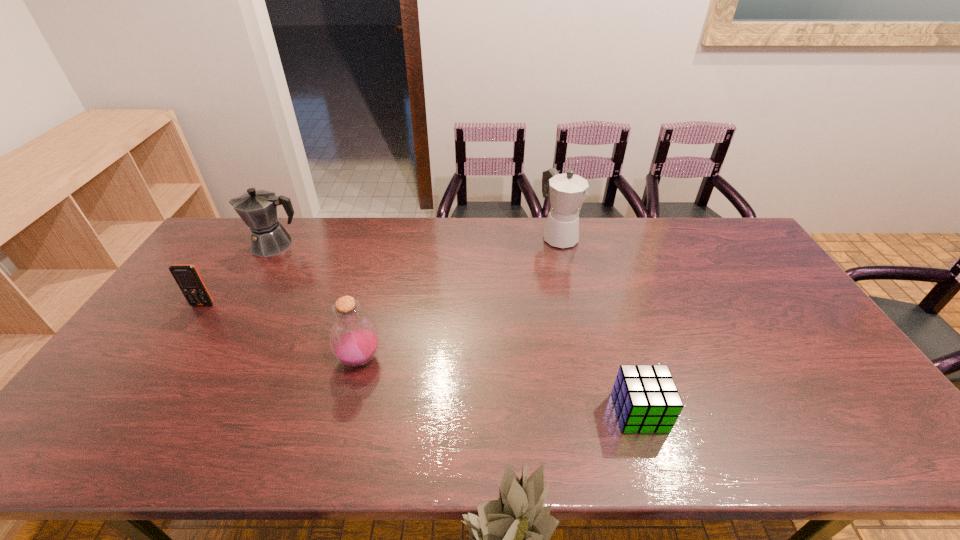
What are the coordinates of `the taller coffeepot` in the screenshot? It's located at (568, 192).

The image size is (960, 540). In order to click on the tallest object in this screenshot , I will do `click(568, 192)`.

In order to click on the shorter coffeepot in this screenshot , I will do `click(258, 209)`.

This screenshot has width=960, height=540. What are the coordinates of `the third object from left to right` in the screenshot? It's located at [354, 338].

Locate an element on the screen. bottle is located at coordinates tap(354, 338).

Where is `the fourth tallest object`? the fourth tallest object is located at coordinates (187, 277).

Identify the location of cellular telephone. (187, 277).

Locate an element on the screen. The height and width of the screenshot is (540, 960). the shortest object is located at coordinates (646, 399).

Where is `cube`? The height and width of the screenshot is (540, 960). cube is located at coordinates (646, 399).

I want to click on vacant area located 0.400m on the right of the taller coffeepot, so click(x=688, y=237).